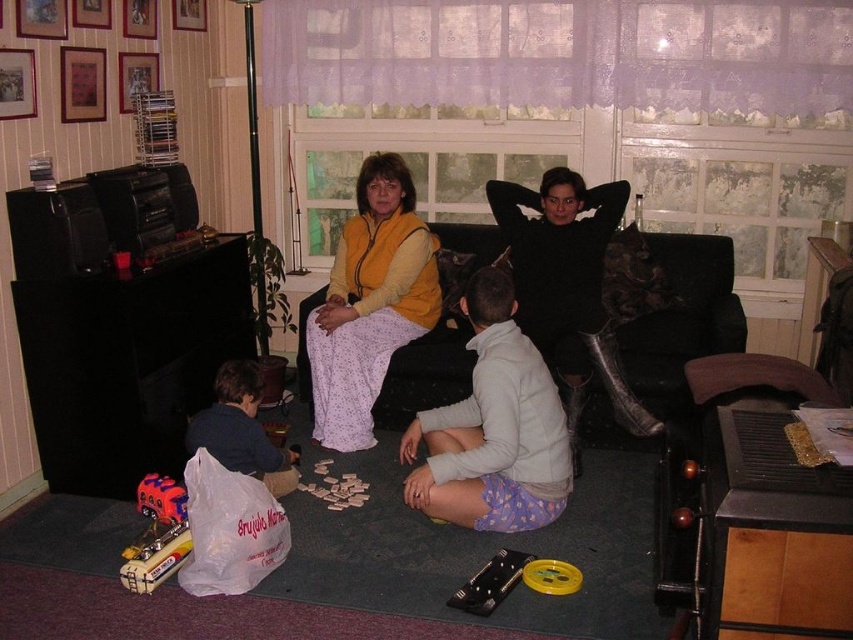
Question: In this image, where is black fabric couch at center located relative to light gray fleece at center?

Choices:
 (A) right
 (B) left

Answer: (A)

Question: Which object is farther from the camera taking this photo?

Choices:
 (A) light gray fleece at center
 (B) yellow plastic spool at lower center
 (C) matte yellow vest at center
 (D) shiny plastic toy car at lower left

Answer: (C)

Question: Which point appears farthest from the camera in this image?

Choices:
 (A) (462, 403)
 (B) (184, 508)
 (C) (534, 577)
 (D) (672, 392)

Answer: (D)

Question: Where is light gray fleece at center located in relation to matte yellow vest at center in the image?

Choices:
 (A) above
 (B) below

Answer: (B)

Question: Which object appears farthest from the camera in this image?

Choices:
 (A) black fabric couch at center
 (B) black leather boots at center

Answer: (B)

Question: Where is black fabric couch at center located in relation to yellow plastic spool at lower center in the image?

Choices:
 (A) above
 (B) below

Answer: (A)